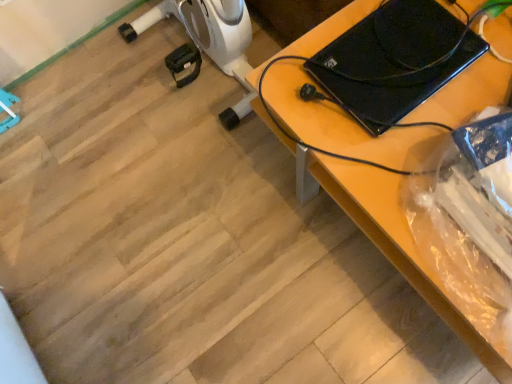
Question: Can black plastic laptop at upper right be found inside black glossy laptop at upper right?

Choices:
 (A) no
 (B) yes

Answer: (A)

Question: From the image's perspective, is black glossy laptop at upper right beneath black plastic laptop at upper right?

Choices:
 (A) yes
 (B) no

Answer: (B)

Question: Considering the relative sizes of black glossy laptop at upper right and black plastic laptop at upper right in the image provided, is black glossy laptop at upper right thinner than black plastic laptop at upper right?

Choices:
 (A) yes
 (B) no

Answer: (A)

Question: Does black glossy laptop at upper right appear on the left side of black plastic laptop at upper right?

Choices:
 (A) no
 (B) yes

Answer: (B)

Question: Considering the relative sizes of black glossy laptop at upper right and black plastic laptop at upper right in the image provided, is black glossy laptop at upper right smaller than black plastic laptop at upper right?

Choices:
 (A) no
 (B) yes

Answer: (B)

Question: From the image's perspective, is black glossy laptop at upper right on black plastic laptop at upper right?

Choices:
 (A) yes
 (B) no

Answer: (A)

Question: Is black plastic laptop at upper right completely or partially outside of black glossy laptop at upper right?

Choices:
 (A) no
 (B) yes

Answer: (B)

Question: From a real-world perspective, is black plastic laptop at upper right over black glossy laptop at upper right?

Choices:
 (A) no
 (B) yes

Answer: (A)

Question: Does black plastic laptop at upper right have a smaller size compared to black glossy laptop at upper right?

Choices:
 (A) yes
 (B) no

Answer: (B)

Question: Is black plastic laptop at upper right closer to camera compared to black glossy laptop at upper right?

Choices:
 (A) yes
 (B) no

Answer: (A)

Question: Is black plastic laptop at upper right not near black glossy laptop at upper right?

Choices:
 (A) no
 (B) yes

Answer: (A)

Question: From the image's perspective, is black plastic laptop at upper right on top of black glossy laptop at upper right?

Choices:
 (A) yes
 (B) no

Answer: (B)

Question: From a real-world perspective, relative to black plastic laptop at upper right, is black glossy laptop at upper right vertically above or below?

Choices:
 (A) below
 (B) above

Answer: (B)